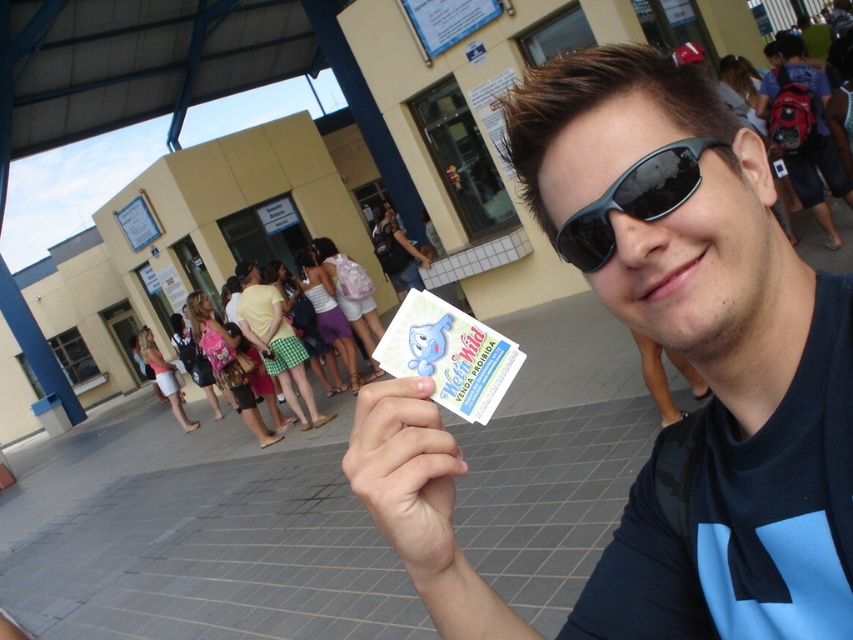
Question: Is matte black sunglasses at center wider than red backpack at right?

Choices:
 (A) no
 (B) yes

Answer: (A)

Question: Estimate the real-world distances between objects in this image. Which object is closer to the white paper at center?

Choices:
 (A) matte black sunglasses at center
 (B) white matte card at center
 (C) red backpack at right

Answer: (B)

Question: Can you confirm if white paper at center is positioned above red backpack at right?

Choices:
 (A) yes
 (B) no

Answer: (B)

Question: Which object appears closest to the camera in this image?

Choices:
 (A) white paper at center
 (B) white matte card at center
 (C) red backpack at right
 (D) black matte sunglasses at center

Answer: (A)

Question: Among these points, which one is nearest to the camera?

Choices:
 (A) (761, 611)
 (B) (822, 124)
 (C) (654, 218)
 (D) (444, 451)

Answer: (C)

Question: Is white paper at center to the left of white matte card at center from the viewer's perspective?

Choices:
 (A) yes
 (B) no

Answer: (A)